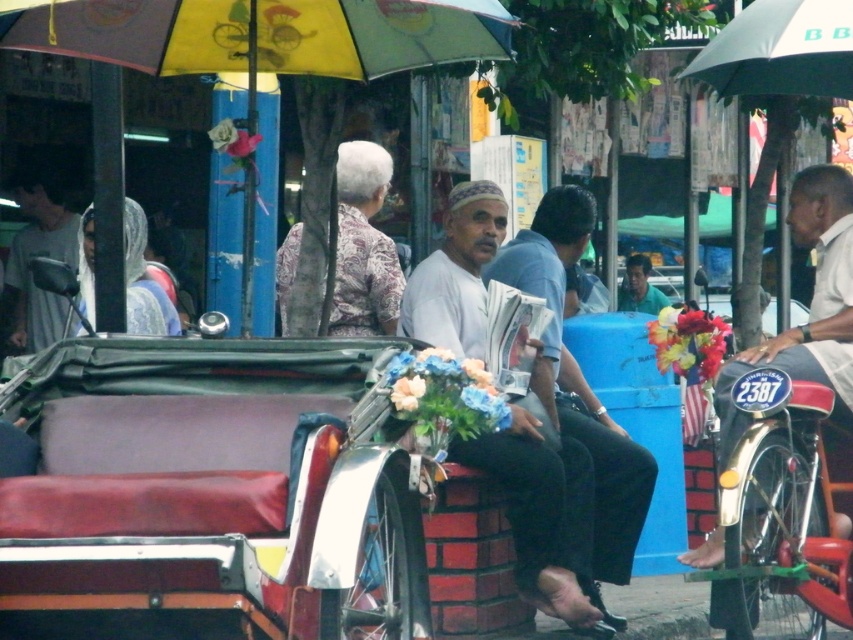
You are a photographer trying to capture both the green fabric umbrella at upper center and the patterned fabric headscarf at center in a single frame. Based on their sizes in the image, which object would require you to adjust your camera to a wider angle to ensure both are fully visible?

The green fabric umbrella at upper center might be wider than patterned fabric headscarf at center, so you would need to adjust your camera to a wider angle to capture the green fabric umbrella at upper center fully in the frame.

You are a tourist who wants to take a photo of the green fabric umbrella at upper center and the patterned fabric headscarf at center. Which object should you focus on first if you want to capture both in one frame without moving the camera?

You should focus on the patterned fabric headscarf at center first because the green fabric umbrella at upper center is to the right of it, so keeping the headscarf centered will allow both to be in the frame.